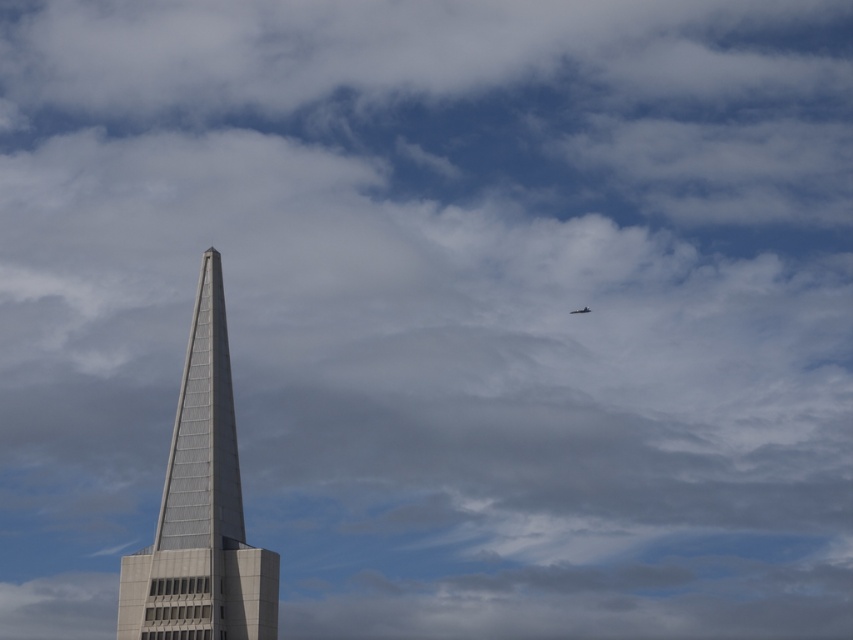
You are an architect observing the gray glass skyscraper at center and the shiny silver airplane at upper right. Which object appears larger in the image?

The gray glass skyscraper at center appears larger because it is much taller than the shiny silver airplane at upper right.

You are standing at the base of the gray glass skyscraper at center. Looking up, you notice an aircraft in the upper right corner of the sky. Based on the coordinates, can you determine if the aircraft is directly above the skyscraper?

The gray glass skyscraper at center is located at coordinates point (201, 508). Since the aircraft is in the upper right corner, it is not directly above the skyscraper.